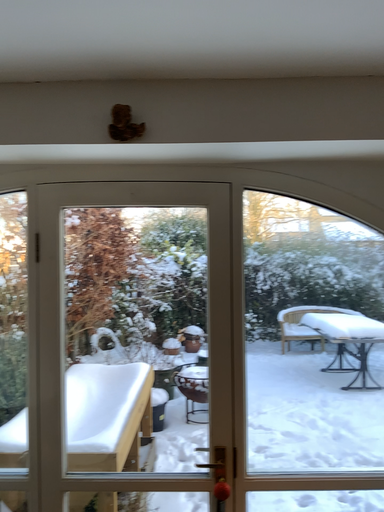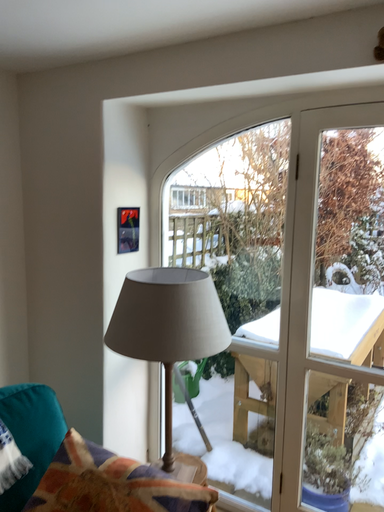
Question: Which way did the camera rotate in the video?

Choices:
 (A) rotated downward
 (B) rotated upward

Answer: (A)